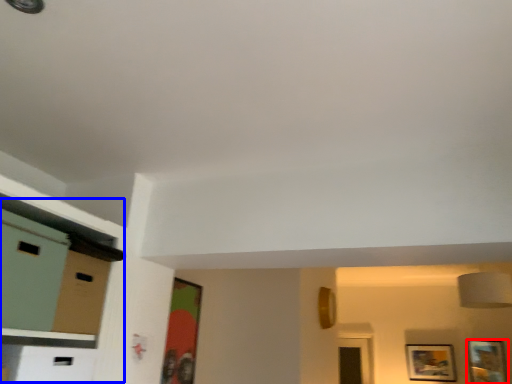
Question: Among these objects, which one is nearest to the camera, picture frame (highlighted by a red box) or dresser (highlighted by a blue box)?

Choices:
 (A) picture frame
 (B) dresser

Answer: (B)